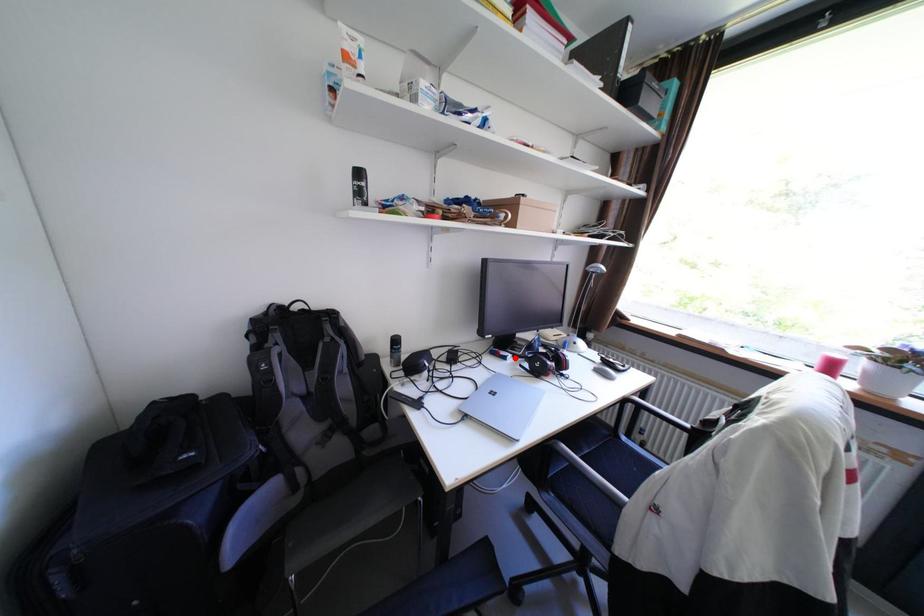
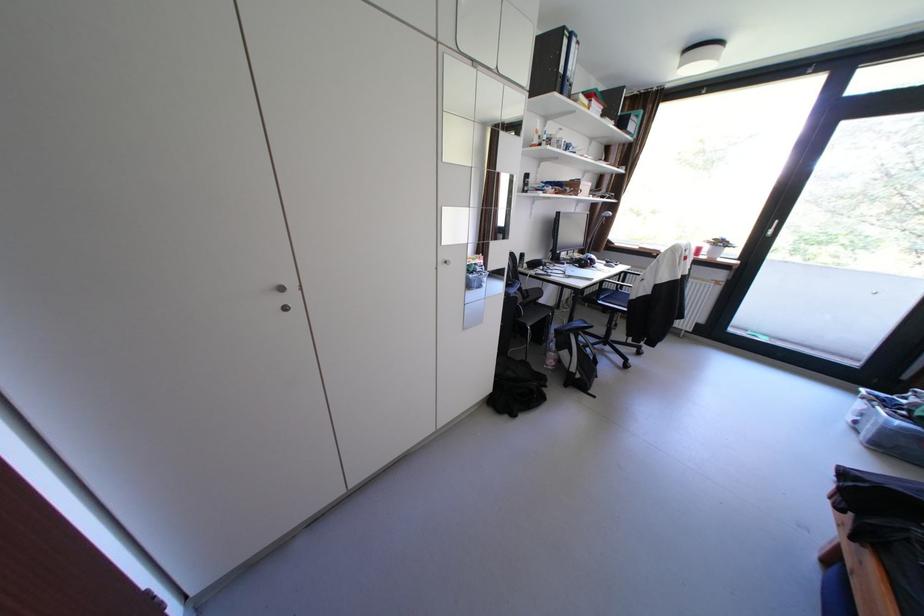
In the second image, find the point that corresponds to the highlighted location in the first image.

(574, 264)